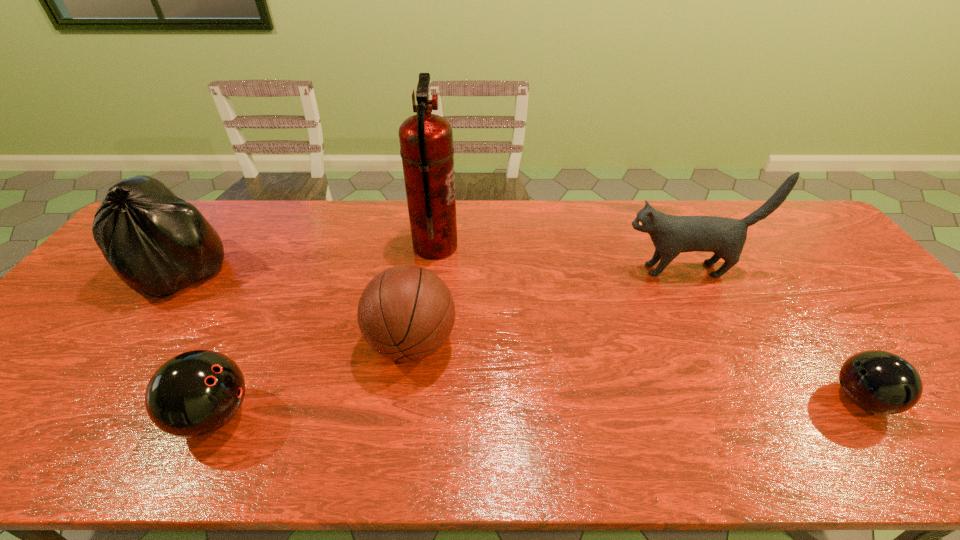
Identify the location of fire extinguisher. (426, 140).

Identify the location of cat. (671, 235).

Where is `plastic bag`? plastic bag is located at coordinates (157, 243).

This screenshot has height=540, width=960. What are the coordinates of `basketball` in the screenshot? It's located at (406, 313).

The image size is (960, 540). What are the coordinates of `the taller bowling ball` in the screenshot? It's located at (195, 393).

You are a GUI agent. You are given a task and a screenshot of the screen. Output one action in this format:
    pyautogui.click(x=<x>, y=<y>)
    Task: Click on the fifth object from right to left
    
    Given the screenshot: What is the action you would take?
    pyautogui.click(x=195, y=393)

Image resolution: width=960 pixels, height=540 pixels. Identify the location of the shortest object. (880, 382).

Where is `the right bowling ball`? The image size is (960, 540). the right bowling ball is located at coordinates (880, 382).

In order to click on blank space located 0.110m on the side of the fire extinguisher with the handle and hose in this screenshot , I will do `click(493, 247)`.

The height and width of the screenshot is (540, 960). Find the location of `vacant space located 0.160m at the face of the cat`. vacant space located 0.160m at the face of the cat is located at coordinates (565, 269).